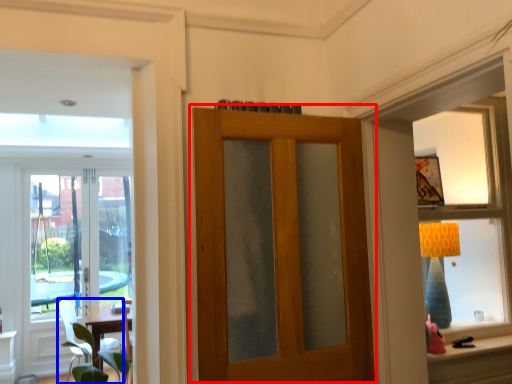
Question: Among these objects, which one is farthest to the camera, door (highlighted by a red box) or chair (highlighted by a blue box)?

Choices:
 (A) door
 (B) chair

Answer: (B)